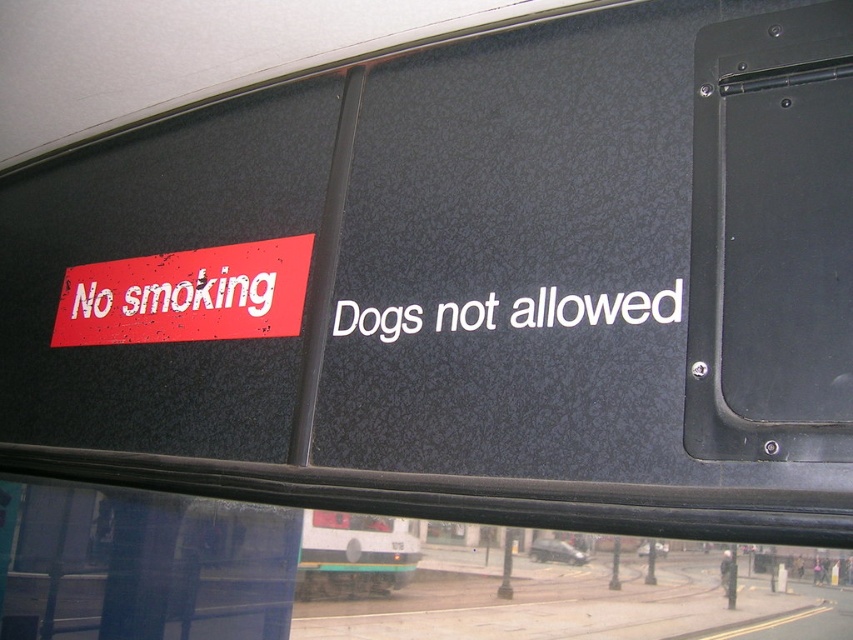
You are a passenger sitting in the front row of the bus and want to check the distance to the red matte sign at upper left. Can you reach it with your hand if you stretch out your arm, considering the average human arm length is about 0.7 meters?

The red matte sign at upper left is 1.34 meters away from viewer. Since the average human arm length is about 0.7 meters, you cannot reach it with your hand if you stretch out your arm.